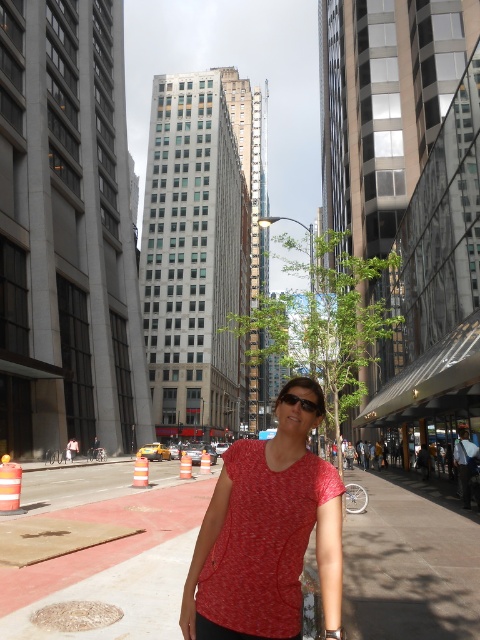
Is red matte shirt at center positioned at the back of green leafy tree at center?

That is False.

Between point (269, 508) and point (280, 301), which one is positioned behind?

The point (280, 301) is behind.

Who is more distant from viewer, [223,515] or [361,396]?

Point [361,396]

Where is `red matte shirt at center`? The image size is (480, 640). red matte shirt at center is located at coordinates (266, 536).

Does smooth concrete sidewalk at center have a lesser height compared to matte black sunglasses at center?

In fact, smooth concrete sidewalk at center may be taller than matte black sunglasses at center.

How distant is smooth concrete sidewalk at center from matte black sunglasses at center?

A distance of 7.90 meters exists between smooth concrete sidewalk at center and matte black sunglasses at center.

I want to click on smooth concrete sidewalk at center, so click(x=408, y=566).

Based on the photo, who is positioned more to the left, green leafy tree at center or matte black sunglasses at center?

matte black sunglasses at center

Is green leafy tree at center further to camera compared to matte black sunglasses at center?

Yes, green leafy tree at center is behind matte black sunglasses at center.

Describe the element at coordinates (324, 324) in the screenshot. I see `green leafy tree at center` at that location.

The height and width of the screenshot is (640, 480). I want to click on green leafy tree at center, so click(x=324, y=324).